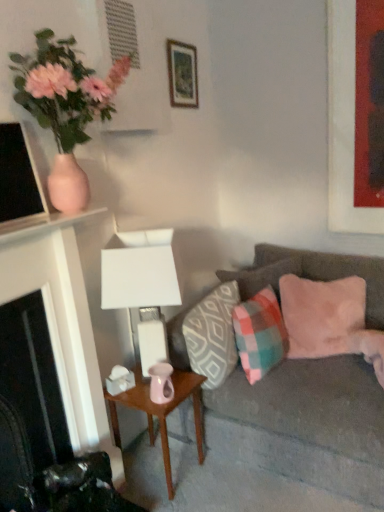
Measure the distance between pink glossy vase at center and camera.

A distance of 5.56 feet exists between pink glossy vase at center and camera.

This screenshot has height=512, width=384. Describe the element at coordinates (65, 106) in the screenshot. I see `pink matte vase at upper left` at that location.

Describe the element at coordinates (344, 125) in the screenshot. I see `matte red picture frame at upper right, the second picture frame positioned from the left` at that location.

Where is `plaid fabric pillow at center right, marked as the 2th pillow in a left-to-right arrangement`? The height and width of the screenshot is (512, 384). plaid fabric pillow at center right, marked as the 2th pillow in a left-to-right arrangement is located at coordinates (260, 334).

Considering the sizes of objects white matte table lamp at center and matte red picture frame at upper right, the second picture frame positioned from the left, in the image provided, who is bigger, white matte table lamp at center or matte red picture frame at upper right, the second picture frame positioned from the left,?

With larger size is white matte table lamp at center.

Based on the photo, is white matte table lamp at center at the left side of matte red picture frame at upper right, which is the 1th picture frame in right-to-left order?

Yes.

Does white matte table lamp at center turn towards matte red picture frame at upper right, which is the 1th picture frame in right-to-left order?

No, white matte table lamp at center is not oriented towards matte red picture frame at upper right, which is the 1th picture frame in right-to-left order.

Considering the sizes of objects white matte table lamp at center and matte red picture frame at upper right, which is the 1th picture frame in right-to-left order, in the image provided, who is shorter, white matte table lamp at center or matte red picture frame at upper right, which is the 1th picture frame in right-to-left order,?

With less height is white matte table lamp at center.

Is pink matte vase at upper left directly adjacent to plaid fabric pillow at center right, marked as the 2th pillow in a left-to-right arrangement?

No.

Based on the photo, from a real-world perspective, is pink matte vase at upper left beneath plaid fabric pillow at center right, marked as the 2th pillow in a left-to-right arrangement?

Incorrect, from a real-world perspective, pink matte vase at upper left is higher than plaid fabric pillow at center right, marked as the 2th pillow in a left-to-right arrangement.

Considering the positions of objects pink matte vase at upper left and plaid fabric pillow at center right, the 3th pillow viewed from the right, in the image provided, who is more to the left, pink matte vase at upper left or plaid fabric pillow at center right, the 3th pillow viewed from the right,?

pink matte vase at upper left is more to the left.

Considering the sizes of objects velvet gray couch at right and black matte fireplace at left in the image provided, who is smaller, velvet gray couch at right or black matte fireplace at left?

Smaller between the two is black matte fireplace at left.

Is velvet gray couch at right located outside black matte fireplace at left?

velvet gray couch at right is positioned outside black matte fireplace at left.

Locate an element on the screen. The image size is (384, 512). fireplace in front of the velvet gray couch at right is located at coordinates (63, 321).

Considering the sizes of objects velvet gray couch at right and black matte fireplace at left in the image provided, who is shorter, velvet gray couch at right or black matte fireplace at left?

velvet gray couch at right.

Can you tell me how much black matte fireplace at left and white matte table lamp at center differ in facing direction?

61.8 degrees separate the facing orientations of black matte fireplace at left and white matte table lamp at center.

Is point (46, 272) farther from camera compared to point (136, 260)?

That is False.

Between black matte fireplace at left and white matte table lamp at center, which one has smaller size?

With smaller size is white matte table lamp at center.

In terms of width, does black matte fireplace at left look wider or thinner when compared to white matte table lamp at center?

black matte fireplace at left is wider than white matte table lamp at center.

Can you confirm if pink glossy vase at center is wider than patterned fabric pillow at center, which is the fourth pillow in right-to-left order?

No, pink glossy vase at center is not wider than patterned fabric pillow at center, which is the fourth pillow in right-to-left order.

Does pink glossy vase at center have a larger size compared to patterned fabric pillow at center, which appears as the first pillow when viewed from the left?

Yes, pink glossy vase at center is bigger than patterned fabric pillow at center, which appears as the first pillow when viewed from the left.

Is pink glossy vase at center positioned behind patterned fabric pillow at center, which appears as the first pillow when viewed from the left?

That is False.

Are pink glossy vase at center and patterned fabric pillow at center, which appears as the first pillow when viewed from the left, far apart?

pink glossy vase at center is actually quite close to patterned fabric pillow at center, which appears as the first pillow when viewed from the left.

From the image's perspective, is pink matte vase at upper left above or below velvet gray couch at right?

From the image's perspective, pink matte vase at upper left appears above velvet gray couch at right.

Image resolution: width=384 pixels, height=512 pixels. Identify the location of houseplant located on the left of velvet gray couch at right. (65, 106).

Is pink matte vase at upper left turned away from velvet gray couch at right?

No, pink matte vase at upper left is not facing away from velvet gray couch at right.

Does pink matte vase at upper left have a smaller size compared to velvet gray couch at right?

Indeed, pink matte vase at upper left has a smaller size compared to velvet gray couch at right.

Is velvet gray couch at right positioned behind wooden picture frame at upper center, the second picture frame in the right-to-left sequence?

That is False.

Considering the sizes of objects velvet gray couch at right and wooden picture frame at upper center, the first picture frame positioned from the left, in the image provided, who is wider, velvet gray couch at right or wooden picture frame at upper center, the first picture frame positioned from the left,?

Wider between the two is velvet gray couch at right.

How different are the orientations of velvet gray couch at right and wooden picture frame at upper center, the second picture frame in the right-to-left sequence, in degrees?

The facing directions of velvet gray couch at right and wooden picture frame at upper center, the second picture frame in the right-to-left sequence, are 89.9 degrees apart.

How far apart are velvet gray couch at right and wooden picture frame at upper center, the second picture frame in the right-to-left sequence?

The distance of velvet gray couch at right from wooden picture frame at upper center, the second picture frame in the right-to-left sequence, is 5.20 feet.

Identify the location of picture frame that is the 1st one when counting backward from the white matte table lamp at center. This screenshot has height=512, width=384. (344, 125).

You are a GUI agent. You are given a task and a screenshot of the screen. Output one action in this format:
    pyautogui.click(x=<x>, y=<y>)
    Task: Click on the 2nd pillow to the right when counting from the pink matte vase at upper left
    The height and width of the screenshot is (512, 384).
    Given the screenshot: What is the action you would take?
    pyautogui.click(x=260, y=334)

From the image, which object appears to be farther from plaid fabric pillow at center right, marked as the 2th pillow in a left-to-right arrangement, black matte fireplace at left or pink matte vase at upper left?

pink matte vase at upper left is further to plaid fabric pillow at center right, marked as the 2th pillow in a left-to-right arrangement.

Considering their positions, is black matte fireplace at left positioned closer to white matte table lamp at center than velvet gray couch at right?

black matte fireplace at left.

Looking at the image, which one is located closer to plaid fabric pillow at center right, the 3th pillow viewed from the right, pink glossy vase at center or pink matte vase at upper left?

Among the two, pink glossy vase at center is located nearer to plaid fabric pillow at center right, the 3th pillow viewed from the right.

Based on their spatial positions, is black matte fireplace at left or pink glossy vase at center further from white matte table lamp at center?

pink glossy vase at center lies further to white matte table lamp at center than the other object.

Which object lies further to the anchor point wooden picture frame at upper center, the second picture frame in the right-to-left sequence, black matte fireplace at left or plaid fabric pillow at center, which is the 3th pillow in left-to-right order?

black matte fireplace at left is further to wooden picture frame at upper center, the second picture frame in the right-to-left sequence.

Estimate the real-world distances between objects in this image. Which object is further from pink velvet cushion at right, placed as the first pillow when sorted from right to left, plaid fabric pillow at center, which is the 3th pillow in left-to-right order, or plaid fabric pillow at center right, the 3th pillow viewed from the right?

plaid fabric pillow at center, which is the 3th pillow in left-to-right order, lies further to pink velvet cushion at right, placed as the first pillow when sorted from right to left, than the other object.

When comparing their distances from plaid fabric pillow at center, which is the 3th pillow in left-to-right order, does velvet gray couch at right or pink velvet cushion at right, arranged as the fourth pillow when viewed from the left, seem closer?

pink velvet cushion at right, arranged as the fourth pillow when viewed from the left, is positioned closer to the anchor plaid fabric pillow at center, which is the 3th pillow in left-to-right order.

Which object lies further to the anchor point velvet gray couch at right, patterned fabric pillow at center, which appears as the first pillow when viewed from the left, or wooden picture frame at upper center, the first picture frame positioned from the left?

wooden picture frame at upper center, the first picture frame positioned from the left, lies further to velvet gray couch at right than the other object.

You are a GUI agent. You are given a task and a screenshot of the screen. Output one action in this format:
    pyautogui.click(x=<x>, y=<y>)
    Task: Click on the houseplant located between black matte fireplace at left and matte red picture frame at upper right, which is the 1th picture frame in right-to-left order, in the left-right direction
    
    Given the screenshot: What is the action you would take?
    [x=65, y=106]

You are a GUI agent. You are given a task and a screenshot of the screen. Output one action in this format:
    pyautogui.click(x=<x>, y=<y>)
    Task: Click on the table lamp situated between pink matte vase at upper left and matte red picture frame at upper right, the second picture frame positioned from the left, from left to right
    The image size is (384, 512).
    Given the screenshot: What is the action you would take?
    [x=142, y=284]

Identify the location of table lamp between pink matte vase at upper left and pink glossy vase at center vertically. The height and width of the screenshot is (512, 384). (142, 284).

I want to click on fireplace between wooden picture frame at upper center, the second picture frame in the right-to-left sequence, and pink glossy vase at center in the up-down direction, so click(63, 321).